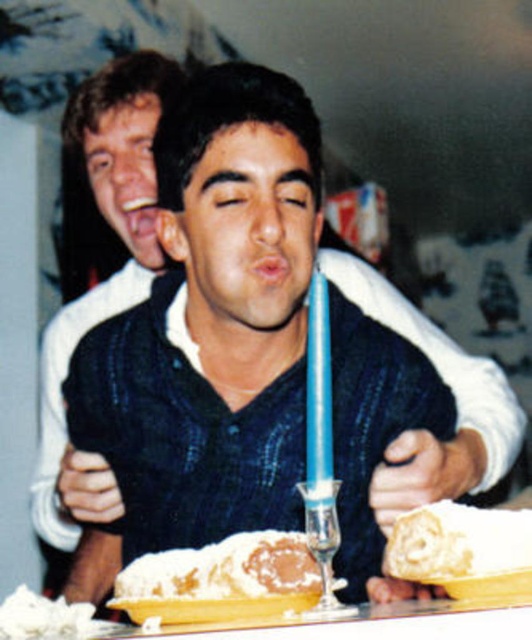
Question: Can you confirm if white fluffy cake at lower center is positioned below blue wax candle at center?

Choices:
 (A) no
 (B) yes

Answer: (B)

Question: Is blue wax candle at center smaller than white fluffy whipped cream at lower left?

Choices:
 (A) no
 (B) yes

Answer: (B)

Question: Which point is farther from the camera taking this photo?

Choices:
 (A) (264, 605)
 (B) (23, 634)
 (C) (325, 355)

Answer: (B)

Question: Can you confirm if white fluffy cake at lower center is wider than blue wax candle at center?

Choices:
 (A) yes
 (B) no

Answer: (A)

Question: Which object appears farthest from the camera in this image?

Choices:
 (A) white fluffy cake at lower center
 (B) white powdered cake at center

Answer: (B)

Question: Which point is farther to the camera?

Choices:
 (A) (489, 582)
 (B) (247, 534)
 (C) (327, 397)

Answer: (B)